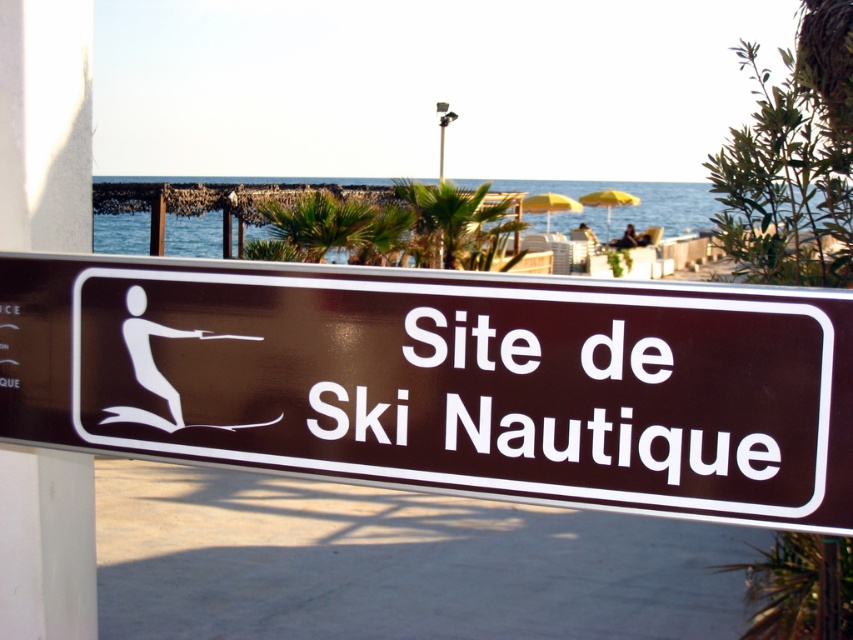
Locate an element on the screen. brown glossy sign at center is located at coordinates (447, 381).

Does brown glossy sign at center have a lesser width compared to green leafy palm tree at center?

Yes.

Does point (97, 284) come closer to viewer compared to point (444, 259)?

Yes.

What do you see at coordinates (447, 381) in the screenshot? The height and width of the screenshot is (640, 853). I see `brown glossy sign at center` at bounding box center [447, 381].

I want to click on brown glossy sign at center, so click(x=447, y=381).

Is white plastic text at center bigger than white plastic sign at center?

Yes.

Does white plastic text at center appear over white plastic sign at center?

Incorrect, white plastic text at center is not positioned above white plastic sign at center.

Who is more distant from viewer, (656, 336) or (12, 308)?

The point (12, 308) is behind.

Find the location of a particular element. The width and height of the screenshot is (853, 640). white plastic text at center is located at coordinates tap(544, 403).